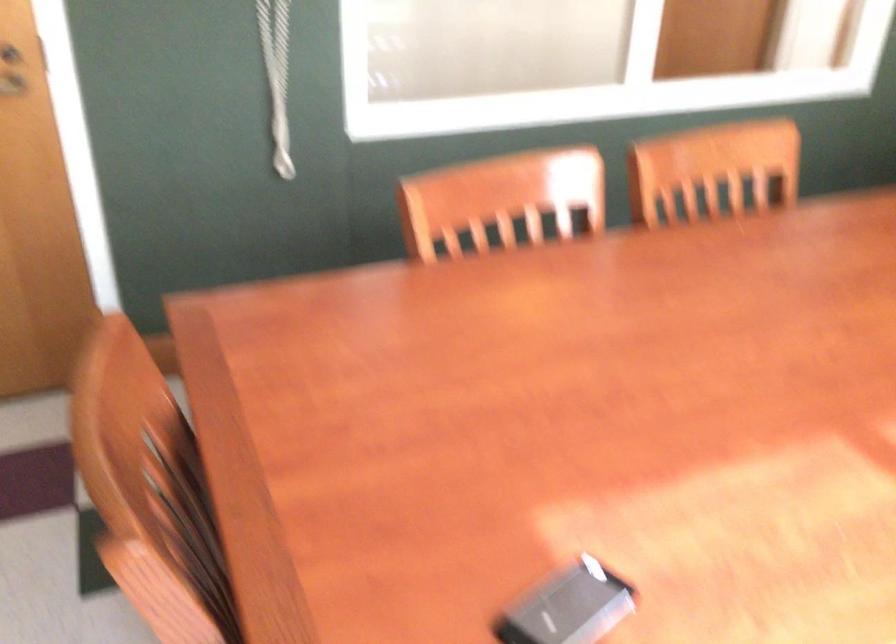
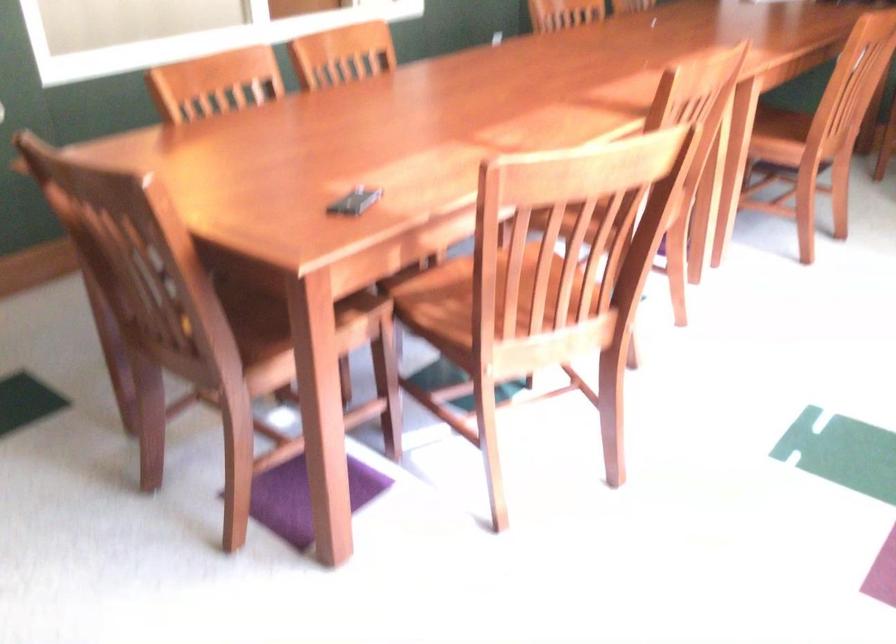
Question: How did the camera likely rotate?

Choices:
 (A) Left
 (B) Right
 (C) Up
 (D) Down

Answer: (B)